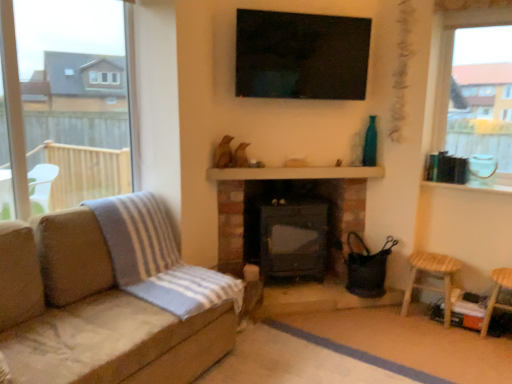
Question: From their relative heights in the image, would you say wooden stool at lower right, which ranks as the first bar stool in right-to-left order, is taller or shorter than black matte fireplace at center?

Choices:
 (A) short
 (B) tall

Answer: (A)

Question: Is wooden stool at lower right, placed as the second bar stool when sorted from left to right, wider or thinner than black matte fireplace at center?

Choices:
 (A) thin
 (B) wide

Answer: (A)

Question: Which object is the closest to the black glossy tv at upper center?

Choices:
 (A) transparent glass window at left, marked as the first window in a left-to-right arrangement
 (B) black matte fireplace at center
 (C) clear glass window at upper right, the first window positioned from the right
 (D) wooden stool at lower right, which is the first bar stool in left-to-right order
 (E) wooden balustrade at center

Answer: (E)

Question: Which is farther from the transparent glass window at left, the 2th window positioned from the right?

Choices:
 (A) black glossy tv at upper center
 (B) wooden stool at lower right, placed as the second bar stool when sorted from left to right
 (C) black matte fireplace at center
 (D) clear glass window at upper right, the first window positioned from the right
 (E) wooden balustrade at center

Answer: (B)